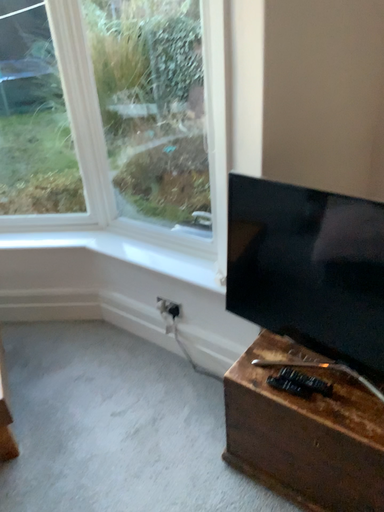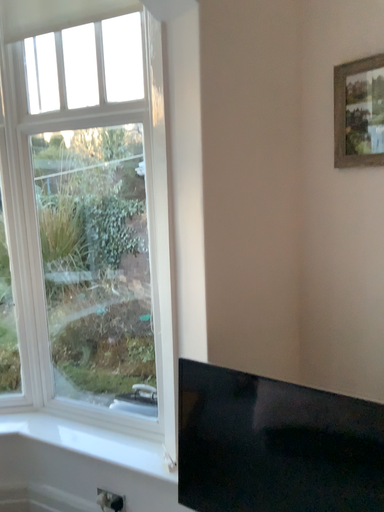
Question: How did the camera likely rotate when shooting the video?

Choices:
 (A) rotated upward
 (B) rotated downward

Answer: (A)